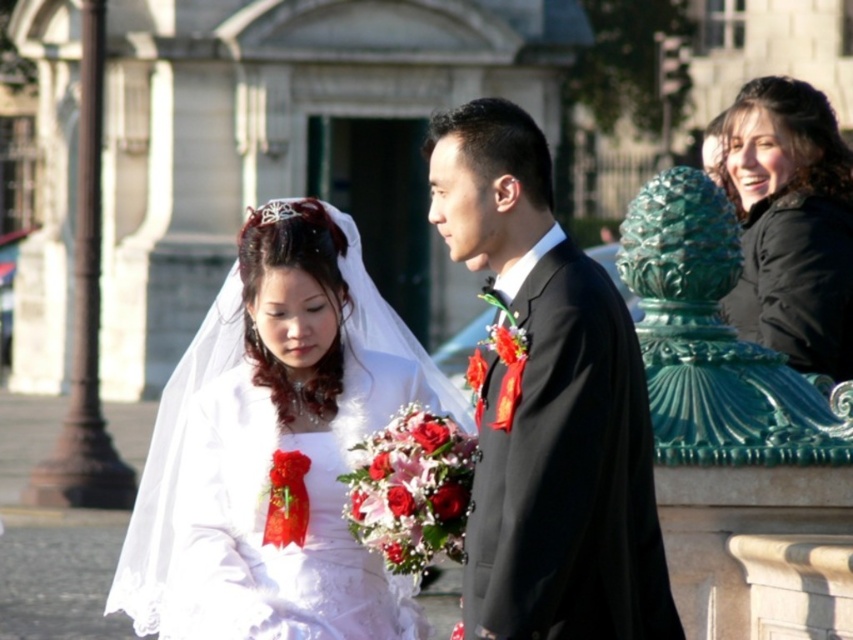
Between shiny black suit at center and black matte jacket at upper right, which one is positioned higher?

shiny black suit at center is above.

Does shiny black suit at center come in front of black matte jacket at upper right?

Yes, shiny black suit at center is closer to the viewer.

Is point (593, 342) less distant than point (807, 83)?

Yes, point (593, 342) is in front of point (807, 83).

Image resolution: width=853 pixels, height=640 pixels. I want to click on shiny black suit at center, so click(547, 404).

Which of these two, black matte jacket at upper right or white satin dress at center, stands shorter?

black matte jacket at upper right is shorter.

Is point (799, 88) closer to viewer compared to point (151, 529)?

No.

Locate an element on the screen. The height and width of the screenshot is (640, 853). black matte jacket at upper right is located at coordinates (791, 224).

Can you confirm if shiny black suit at center is bigger than white satin dress at center?

No, shiny black suit at center is not bigger than white satin dress at center.

Does shiny black suit at center appear on the right side of white satin dress at center?

Indeed, shiny black suit at center is positioned on the right side of white satin dress at center.

Image resolution: width=853 pixels, height=640 pixels. What do you see at coordinates (547, 404) in the screenshot?
I see `shiny black suit at center` at bounding box center [547, 404].

Where is `shiny black suit at center`? The width and height of the screenshot is (853, 640). shiny black suit at center is located at coordinates (547, 404).